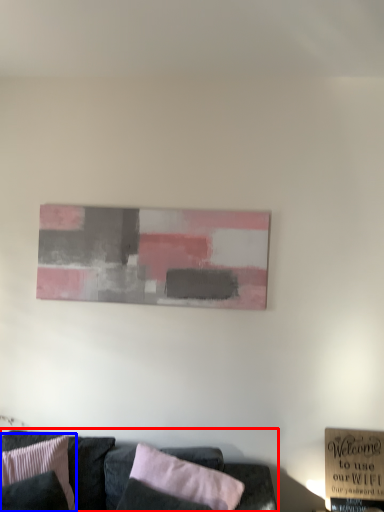
Question: Among these objects, which one is nearest to the camera, studio couch (highlighted by a red box) or pillow (highlighted by a blue box)?

Choices:
 (A) studio couch
 (B) pillow

Answer: (A)